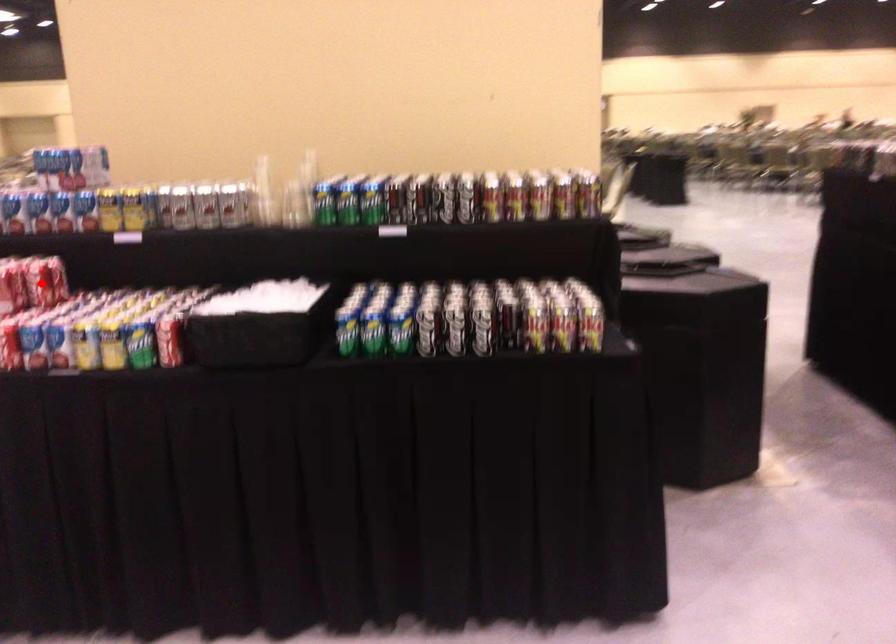
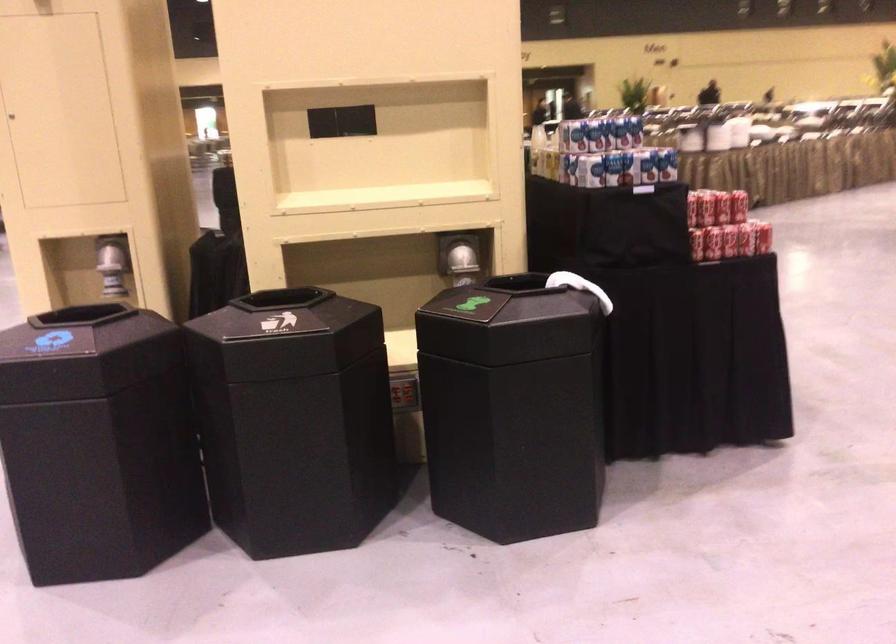
Question: I am providing you with two images of the same scene from different viewpoints. A red point is marked on the first image. Is the red point's position out of view in image 2?

Choices:
 (A) Yes
 (B) No

Answer: (A)